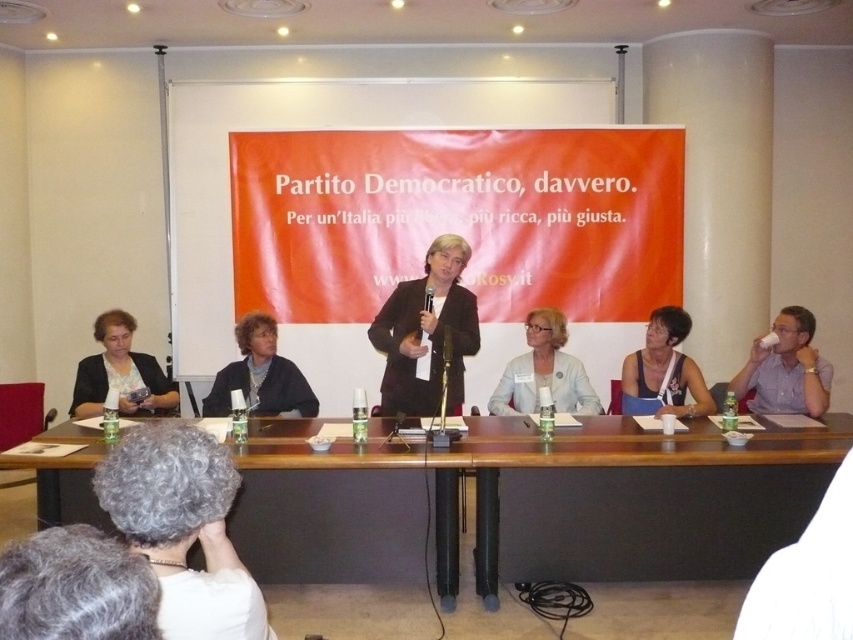
Question: Is matte black jacket at center above matte black tank top at center?

Choices:
 (A) yes
 (B) no

Answer: (A)

Question: Which of the following is the closest to the observer?

Choices:
 (A) matte black tank top at center
 (B) white matte cup at right
 (C) matte black jacket at left
 (D) matte black jacket at center

Answer: (A)

Question: Is gray curly hair at lower left to the left of matte black jacket at center from the viewer's perspective?

Choices:
 (A) no
 (B) yes

Answer: (A)

Question: Does brown wooden table at center have a larger size compared to light blue fabric jacket at center?

Choices:
 (A) no
 (B) yes

Answer: (B)

Question: Which is nearer to the light brown leather jacket at center?

Choices:
 (A) white matte cup at right
 (B) matte black jacket at center
 (C) gray curly hair at lower left

Answer: (B)

Question: Which of these objects is positioned closest to the light blue fabric jacket at center?

Choices:
 (A) gray curly hair at lower left
 (B) matte black jacket at left

Answer: (B)